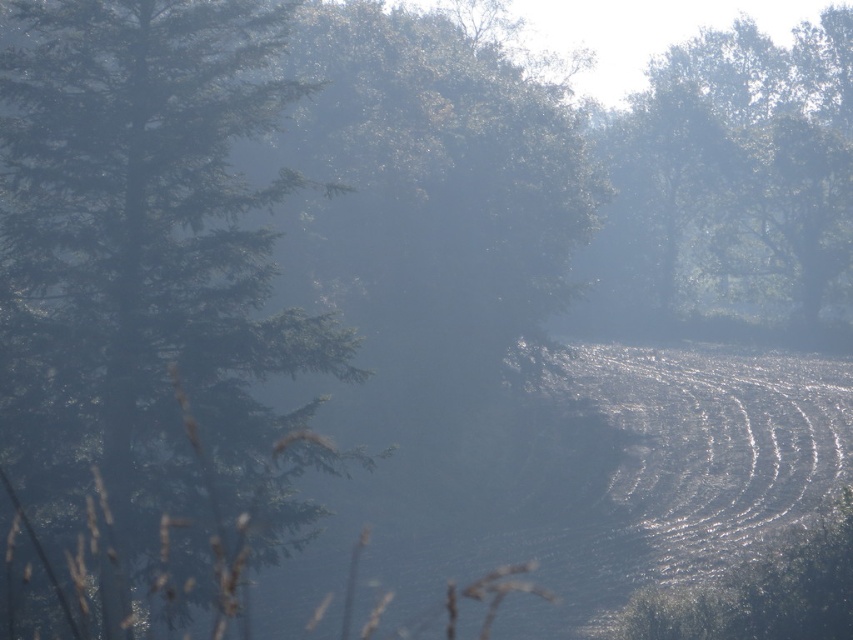
You are a bird looking for a nesting spot. You see the green matte tree at left and the green leafy tree at upper right. Which tree would you choose if you prefer a smaller nesting area?

The green matte tree at left has a smaller size compared to the green leafy tree at upper right, so you should choose the green matte tree at left for a smaller nesting area.

You are a bird looking for a nesting spot. You see the green matte tree at left and the green leafy tree at upper right. Which tree would be a better choice if you prefer a thicker tree for nesting?

The green leafy tree at upper right is thicker than the green matte tree at left, so it would be a better choice for nesting.